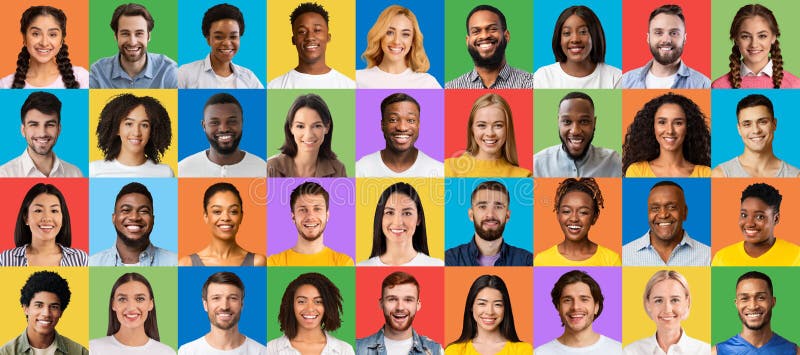
Identify the location of pictures in bottom row. This screenshot has width=800, height=355. point(42,303), point(130,302), point(226,312), point(310,312), point(398,312), point(488,306), point(578,308), point(661,306), point(758,304).